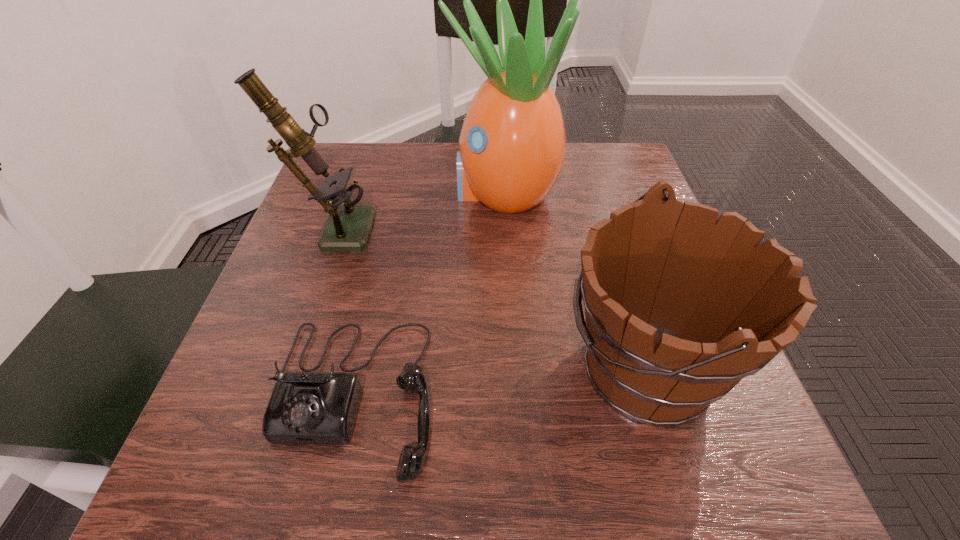
You are a GUI agent. You are given a task and a screenshot of the screen. Output one action in this format:
    pyautogui.click(x=<x>, y=<y>)
    Task: Click on the vacant space located with the handle on the third tallest object
    This screenshot has width=960, height=540.
    Given the screenshot: What is the action you would take?
    pyautogui.click(x=300, y=367)

Find the location of a particular element. Image resolution: width=960 pixels, height=540 pixels. object present at the far edge is located at coordinates (511, 148).

Find the location of `wine bucket located at the near edge`. wine bucket located at the near edge is located at coordinates (680, 306).

This screenshot has width=960, height=540. Find the location of `telephone that is at the near edge`. telephone that is at the near edge is located at coordinates (309, 407).

Image resolution: width=960 pixels, height=540 pixels. I want to click on microscope located at the left edge, so click(348, 227).

Locate an element on the screen. telephone situated at the left edge is located at coordinates (309, 407).

Where is `object positioned at the right edge`? object positioned at the right edge is located at coordinates coord(680,306).

Locate an element on the screen. Image resolution: width=960 pixels, height=540 pixels. object that is at the near left corner is located at coordinates [x=309, y=407].

At what (x,y) coordinates should I click in order to perform the action: click on object that is at the near right corner. Please return your answer as a coordinate pair (x, y). Looking at the image, I should click on (680, 306).

Find the location of `blank space at the far edge of the desktop`. blank space at the far edge of the desktop is located at coordinates (413, 181).